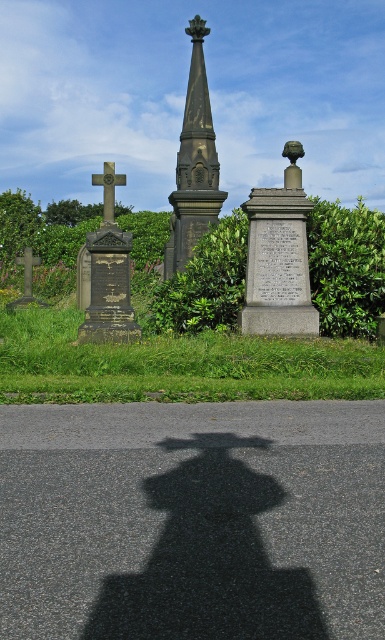
You are a gardener planning to trim the green leafy hedge at center and the gray stone monument at center. Which object requires more horizontal space to maintain its current shape?

The green leafy hedge at center might be wider than gray stone monument at center, so it requires more horizontal space to maintain its current shape.

You are standing at the entrance of the cemetery and see the green leafy hedge at center and the gray stone monument at center. Which one is located to the left side of the other?

The green leafy hedge at center is positioned on the left side of gray stone monument at center.